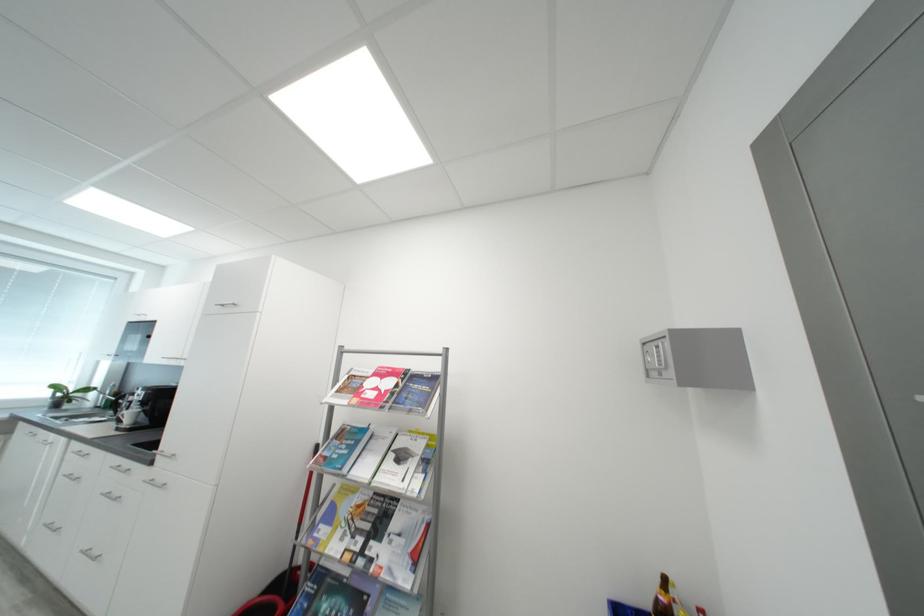
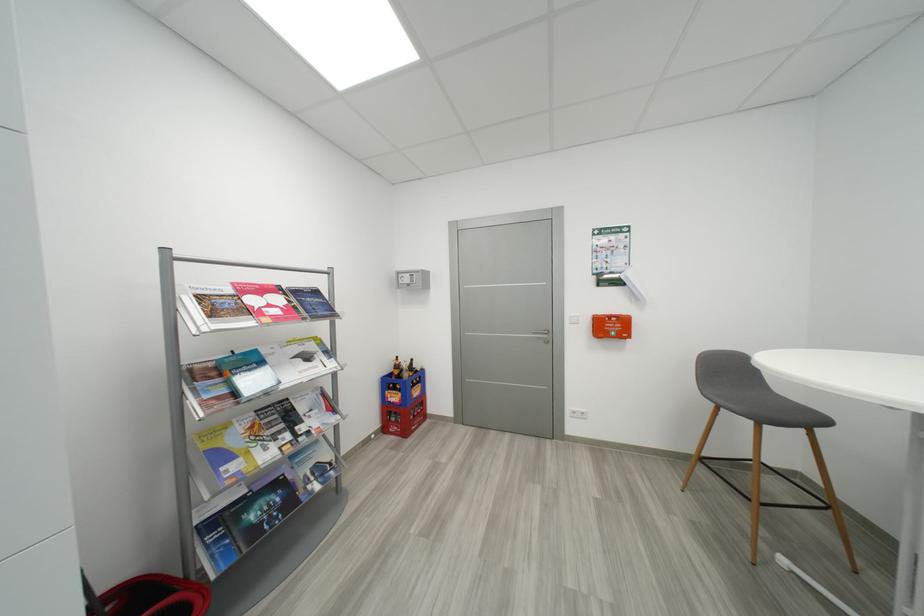
Find the pixel in the second image that matches (x=368, y=545) in the first image.

(294, 438)